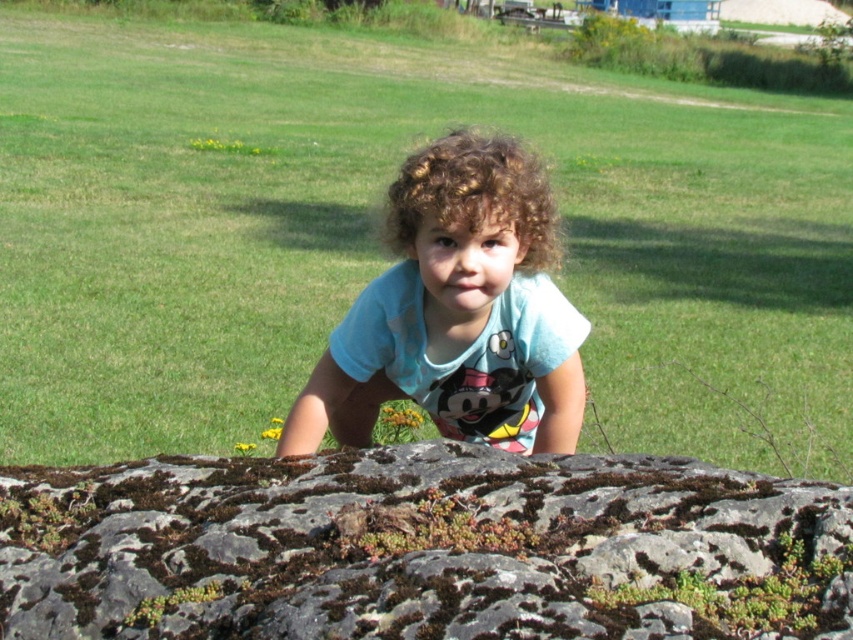
Identify the location of light blue cotton shirt at center. (457, 310).

In order to click on light blue cotton shirt at center in this screenshot , I will do `click(457, 310)`.

Who is more distant from viewer, (514, 621) or (395, 216)?

Point (395, 216)

What do you see at coordinates (421, 548) in the screenshot? The image size is (853, 640). I see `green mossy rock at center` at bounding box center [421, 548].

The width and height of the screenshot is (853, 640). Find the location of `green mossy rock at center`. green mossy rock at center is located at coordinates (421, 548).

The height and width of the screenshot is (640, 853). I want to click on green mossy rock at center, so click(421, 548).

Who is shorter, green mossy rock at center or light blue cotton shirt at center?

Standing shorter between the two is green mossy rock at center.

Does green mossy rock at center have a smaller size compared to light blue cotton shirt at center?

Actually, green mossy rock at center might be larger than light blue cotton shirt at center.

Which is in front, point (554, 637) or point (421, 328)?

Point (554, 637) is more forward.

Image resolution: width=853 pixels, height=640 pixels. I want to click on green mossy rock at center, so click(421, 548).